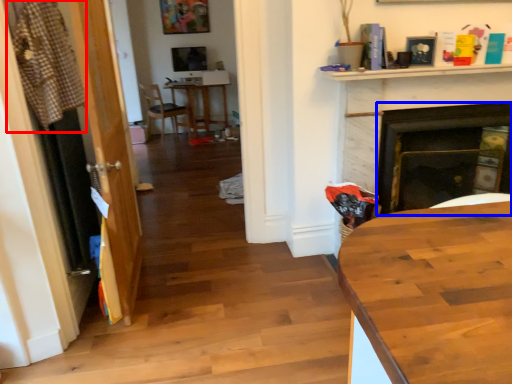
Question: Which object appears closest to the camera in this image, laundry (highlighted by a red box) or fireplace (highlighted by a blue box)?

Choices:
 (A) laundry
 (B) fireplace

Answer: (A)